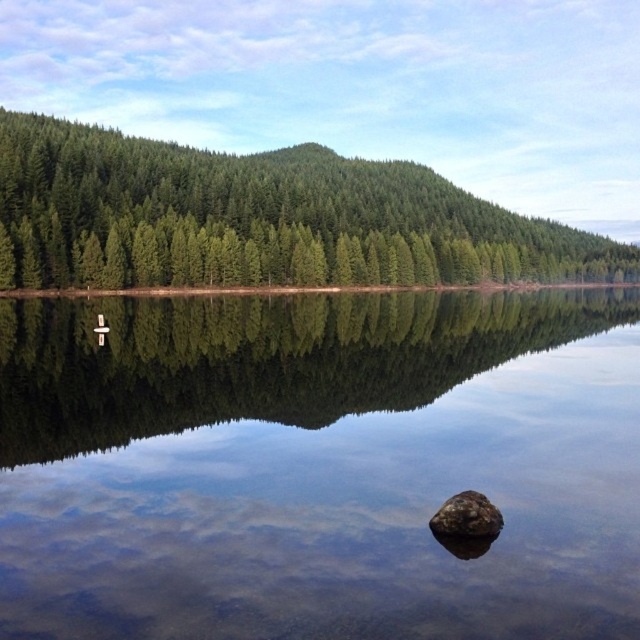
Question: In this image, where is clear glass water at center located relative to brown rough rock at center?

Choices:
 (A) left
 (B) right

Answer: (B)

Question: Is clear glass water at center behind brown rough rock at center?

Choices:
 (A) yes
 (B) no

Answer: (B)

Question: Which object is positioned farthest from the clear glass water at center?

Choices:
 (A) brown rough rock at center
 (B) green matte trees at upper center

Answer: (B)

Question: Can you confirm if clear glass water at center is positioned to the right of brown rough rock at center?

Choices:
 (A) no
 (B) yes

Answer: (B)

Question: Which point is closer to the camera?

Choices:
 (A) (474, 268)
 (B) (477, 502)
 (C) (337, 600)

Answer: (C)

Question: Estimate the real-world distances between objects in this image. Which object is closer to the brown rough rock at center?

Choices:
 (A) green matte trees at upper center
 (B) clear glass water at center

Answer: (B)